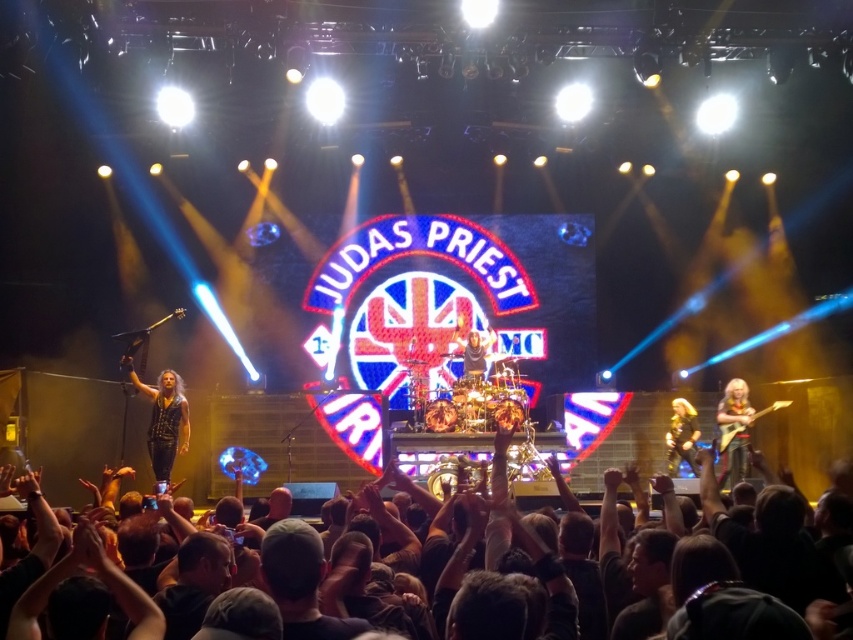
How far apart are leather jacket at center and shiny black leather jacket at right?

The distance of leather jacket at center from shiny black leather jacket at right is 204.48 feet.

Identify the location of leather jacket at center. (163, 419).

Can you confirm if shiny black leather jacket at right is thinner than shiny gold drum set at center?

Yes, shiny black leather jacket at right is thinner than shiny gold drum set at center.

Is shiny black leather jacket at right closer to camera compared to shiny gold drum set at center?

Yes, shiny black leather jacket at right is closer to the viewer.

Where is `shiny black leather jacket at right`? shiny black leather jacket at right is located at coordinates (682, 435).

Locate an element on the screen. The image size is (853, 640). shiny black leather jacket at right is located at coordinates (682, 435).

Is shiny gold guitar at right closer to camera compared to shiny black leather jacket at right?

Yes, it is in front of shiny black leather jacket at right.

Can you confirm if shiny gold guitar at right is positioned below shiny black leather jacket at right?

Incorrect, shiny gold guitar at right is not positioned below shiny black leather jacket at right.

Is point (746, 397) closer to camera compared to point (686, 442)?

No, (746, 397) is further to viewer.

Identify the location of shiny gold guitar at right. (734, 429).